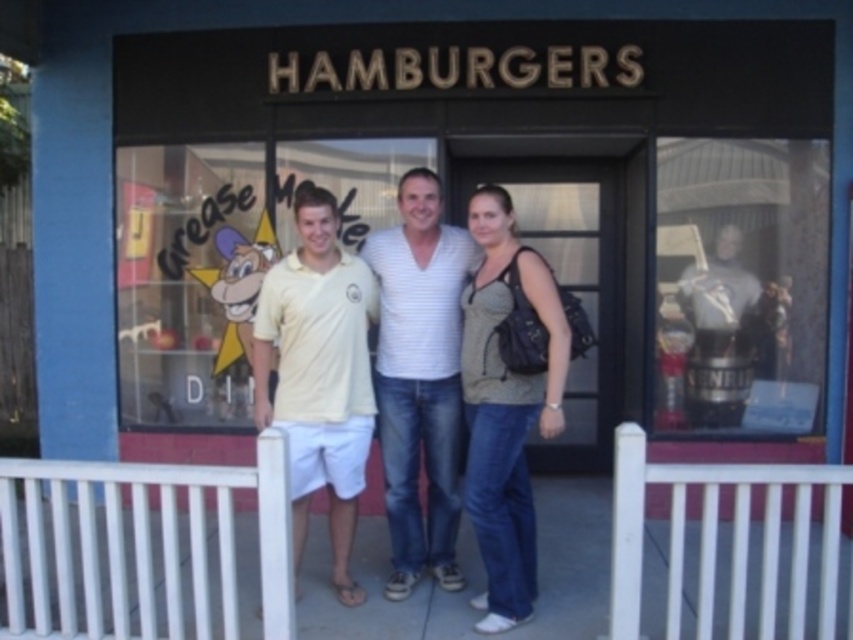
You are trying to decide between two yellow shirts to wear for a casual outing. You see the light yellow cotton shirt at center and the yellow cotton polo shirt at center in the scene. Which one is taller?

The light yellow cotton shirt at center is taller than the yellow cotton polo shirt at center.

You are trying to decide which shirt to wear for a casual day out. You see two shirts in the image, the light yellow cotton shirt at center and the white striped shirt at center. Which shirt is on the left side?

The light yellow cotton shirt at center is positioned on the left side of the white striped shirt at center, so the light yellow cotton shirt at center is on the left side.

You are a customer standing in front of the HAMBURGURS storefront. You notice two men wearing yellow clothing. The man on the left wears a light yellow cotton shirt at center, and the man on the right wears a yellow cotton polo shirt at center. Which of their yellow garments takes up more space in the image?

The yellow cotton polo shirt at center takes up more space in the image than the light yellow cotton shirt at center.